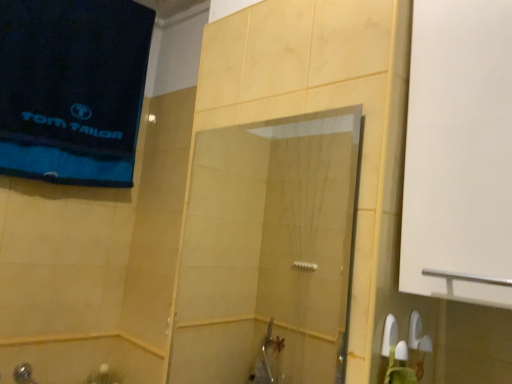
Question: Is blue cotton towel at upper left turned away from shiny metallic showerhead at lower left?

Choices:
 (A) yes
 (B) no

Answer: (B)

Question: From the image's perspective, is blue cotton towel at upper left beneath shiny metallic showerhead at lower left?

Choices:
 (A) yes
 (B) no

Answer: (B)

Question: Is blue cotton towel at upper left far from shiny metallic showerhead at lower left?

Choices:
 (A) no
 (B) yes

Answer: (B)

Question: Considering the relative sizes of blue cotton towel at upper left and shiny metallic showerhead at lower left in the image provided, is blue cotton towel at upper left wider than shiny metallic showerhead at lower left?

Choices:
 (A) no
 (B) yes

Answer: (B)

Question: Would you say blue cotton towel at upper left contains shiny metallic showerhead at lower left?

Choices:
 (A) yes
 (B) no

Answer: (B)

Question: From a real-world perspective, is blue cotton towel at upper left under shiny metallic showerhead at lower left?

Choices:
 (A) yes
 (B) no

Answer: (B)

Question: Is transparent glass shower door at center to the right of shiny metallic showerhead at lower left from the viewer's perspective?

Choices:
 (A) no
 (B) yes

Answer: (B)

Question: Could you tell me if transparent glass shower door at center is turned towards shiny metallic showerhead at lower left?

Choices:
 (A) yes
 (B) no

Answer: (B)

Question: From a real-world perspective, is transparent glass shower door at center located higher than shiny metallic showerhead at lower left?

Choices:
 (A) yes
 (B) no

Answer: (A)

Question: Considering the relative sizes of transparent glass shower door at center and shiny metallic showerhead at lower left in the image provided, is transparent glass shower door at center shorter than shiny metallic showerhead at lower left?

Choices:
 (A) no
 (B) yes

Answer: (A)

Question: Does transparent glass shower door at center appear on the left side of shiny metallic showerhead at lower left?

Choices:
 (A) yes
 (B) no

Answer: (B)

Question: Are transparent glass shower door at center and shiny metallic showerhead at lower left located far from each other?

Choices:
 (A) no
 (B) yes

Answer: (B)

Question: From the image's perspective, is shiny metallic showerhead at lower left located beneath blue cotton towel at upper left?

Choices:
 (A) yes
 (B) no

Answer: (A)